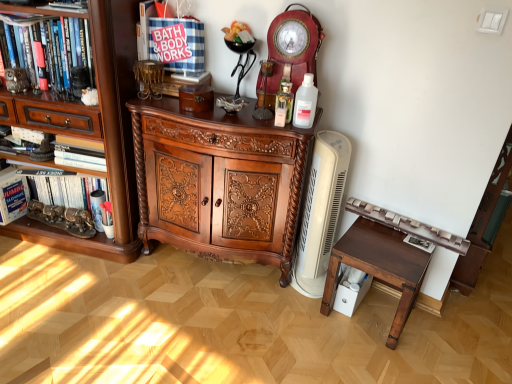
Where is `vacant space in front of white plastic heater at right`? The image size is (512, 384). vacant space in front of white plastic heater at right is located at coordinates [303, 311].